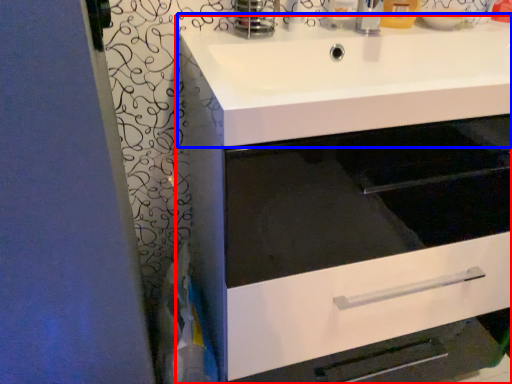
Question: Which object is closer to the camera taking this photo, bathroom cabinet (highlighted by a red box) or sink (highlighted by a blue box)?

Choices:
 (A) bathroom cabinet
 (B) sink

Answer: (B)